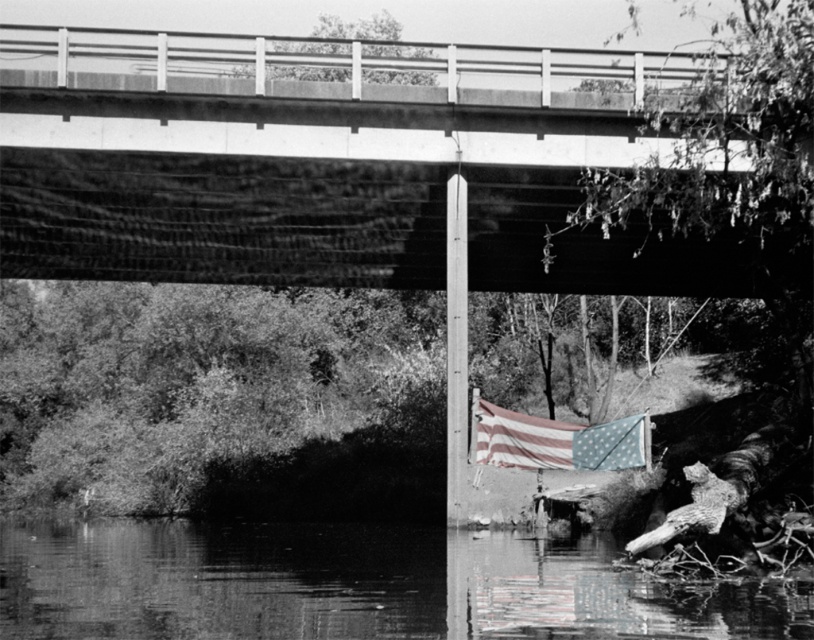
You are a photographer trying to capture the reflection of the american flag at lower right in the smooth water at lower center. Considering their sizes, will the reflection of the flag be fully visible within the water?

The smooth water at lower center is wider than the american flag at lower right, so the reflection of the flag will be fully visible within the water.

You are a photographer who wants to capture the american flag at lower right and the smooth water at lower center in a single shot. Since the camera can only focus on one object at a time, which object should you prioritize focusing on to ensure it appears larger in the photo?

The smooth water at lower center is larger in size than the american flag at lower right, so you should prioritize focusing on the smooth water at lower center to ensure it appears larger in the photo.